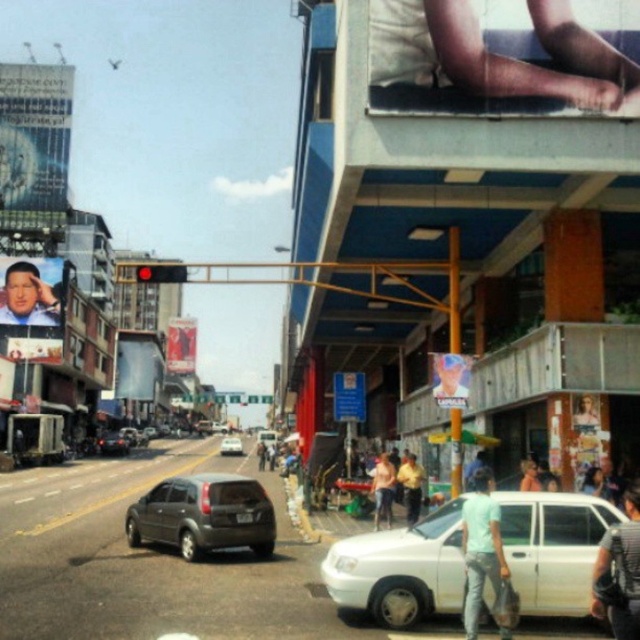
Does light blue cotton shirt at lower right appear on the left side of metallic silver face at center?

Correct, you'll find light blue cotton shirt at lower right to the left of metallic silver face at center.

Is the position of light blue cotton shirt at lower right more distant than that of metallic silver face at center?

No, light blue cotton shirt at lower right is closer to the viewer.

Is point (476, 552) behind point (460, 385)?

No.

This screenshot has width=640, height=640. I want to click on light blue cotton shirt at lower right, so click(481, 548).

Between smooth skin face at upper left and smooth skin portrait at center, which one is positioned higher?

Positioned higher is smooth skin face at upper left.

Can you confirm if smooth skin face at upper left is bigger than smooth skin portrait at center?

No.

Does point (42, 324) lie in front of point (577, 404)?

No, it is behind (577, 404).

Locate an element on the screen. smooth skin face at upper left is located at coordinates (29, 292).

Which is in front, point (68, 102) or point (540, 484)?

Point (540, 484) is in front.

Is metallic silver billboard at upper left shorter than smooth skin face at center?

No.

Locate an element on the screen. The width and height of the screenshot is (640, 640). metallic silver billboard at upper left is located at coordinates (35, 134).